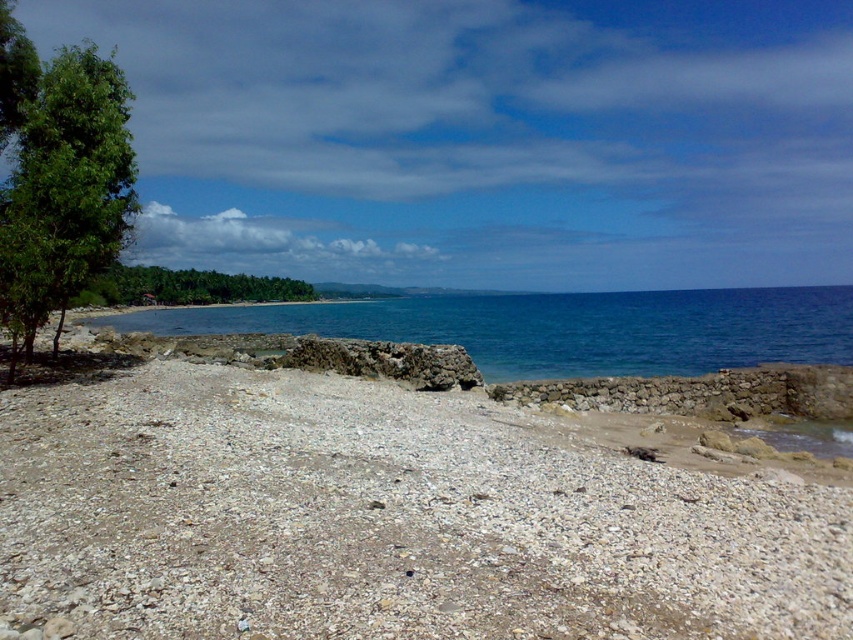
You are standing on the pebbled beach and see two points marked on the ground. The first point is at coordinate point[529,573] and the second is at point[51,100]. Which point is closer to you if you are facing the sea?

Point[529,573] is in front of point[51,100], so it is closer to you when facing the sea.

You are standing at the point marked as point [65,188] on the map. Which direction should you walk to reach the green leafy tree at left?

The green leafy tree at left is located exactly at the point [65,188] where you are standing, so you are already at the tree.

You are standing at the point marked as point (386, 518) in the image. What is the immediate surface beneath your feet?

The immediate surface beneath your feet at point (386, 518) is the gray gravel beach at center.